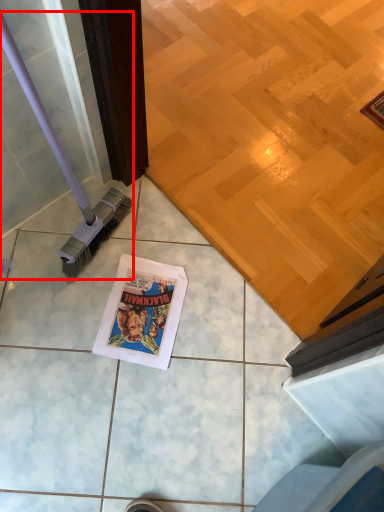
Question: Observing the image, what is the correct spatial positioning of brush (annotated by the red box) in reference to comic book?

Choices:
 (A) right
 (B) left

Answer: (B)